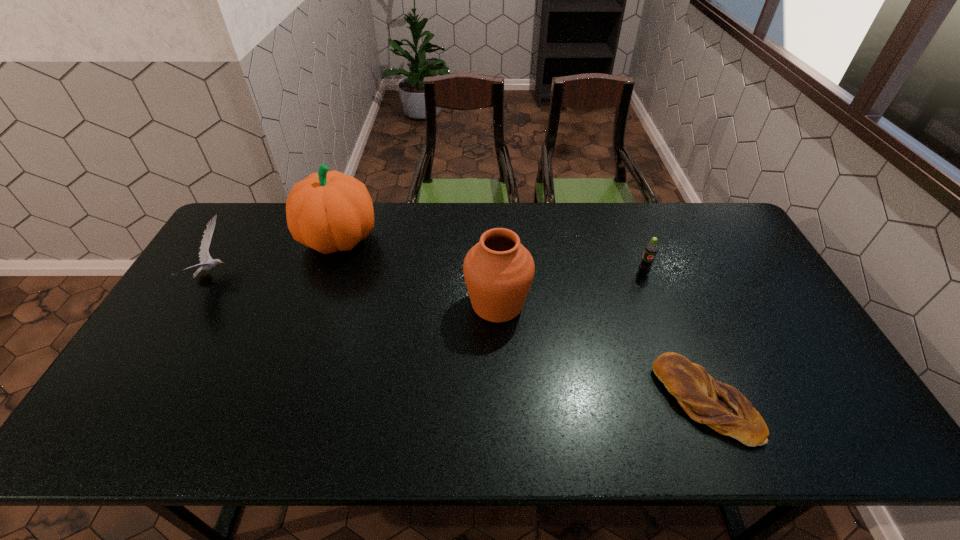
Locate an element on the screen. The image size is (960, 540). free point between the nearest object and the leftmost object is located at coordinates (460, 338).

Identify the location of free point between the nearest object and the soda. Image resolution: width=960 pixels, height=540 pixels. (674, 337).

You are a GUI agent. You are given a task and a screenshot of the screen. Output one action in this format:
    pyautogui.click(x=<x>, y=<y>)
    Task: Click on the vacant point located between the fourth shortest object and the gull
    This screenshot has width=960, height=540.
    Given the screenshot: What is the action you would take?
    pyautogui.click(x=355, y=290)

Identify the location of vacant space that is in between the gull and the soda. Image resolution: width=960 pixels, height=540 pixels. (428, 274).

What are the coordinates of `free spot between the urn and the fourth object from right to left` in the screenshot? It's located at coord(419,272).

Where is `empty space between the fourth object from right to left and the bread`? empty space between the fourth object from right to left and the bread is located at coordinates (522, 320).

The height and width of the screenshot is (540, 960). Find the location of `vacant point located between the soda and the nearest object`. vacant point located between the soda and the nearest object is located at coordinates (674, 337).

Find the location of a particular element. object that is the second nearest to the third object from right to left is located at coordinates (722, 407).

You are a GUI agent. You are given a task and a screenshot of the screen. Output one action in this format:
    pyautogui.click(x=<x>, y=<y>)
    Task: Click on the object that stands as the fourth closest to the soda
    
    Given the screenshot: What is the action you would take?
    pyautogui.click(x=204, y=255)

Locate an element on the screen. vacant space that satisfies the following two spatial constraints: 1. at the tip of the beak of the gull; 2. on the back side of the nearest object is located at coordinates (138, 401).